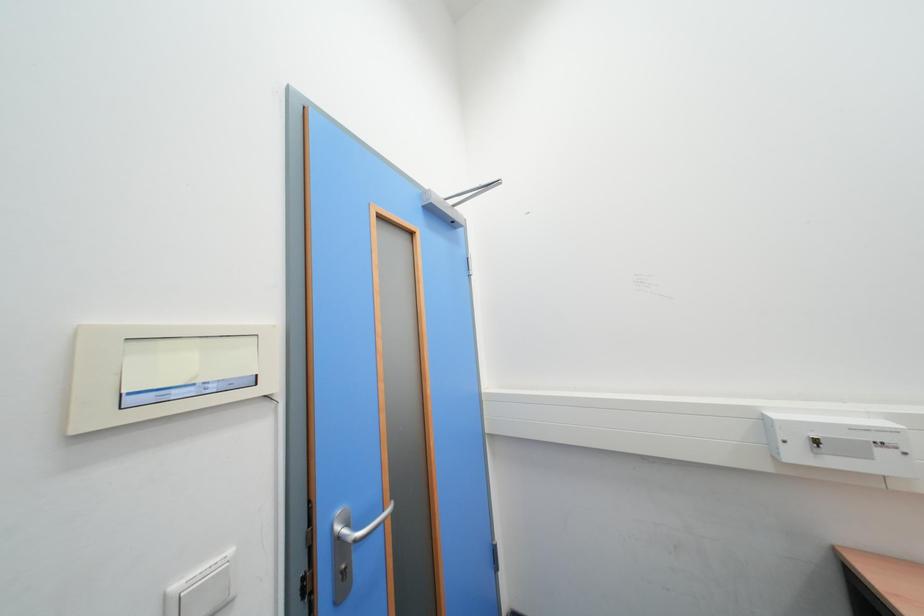
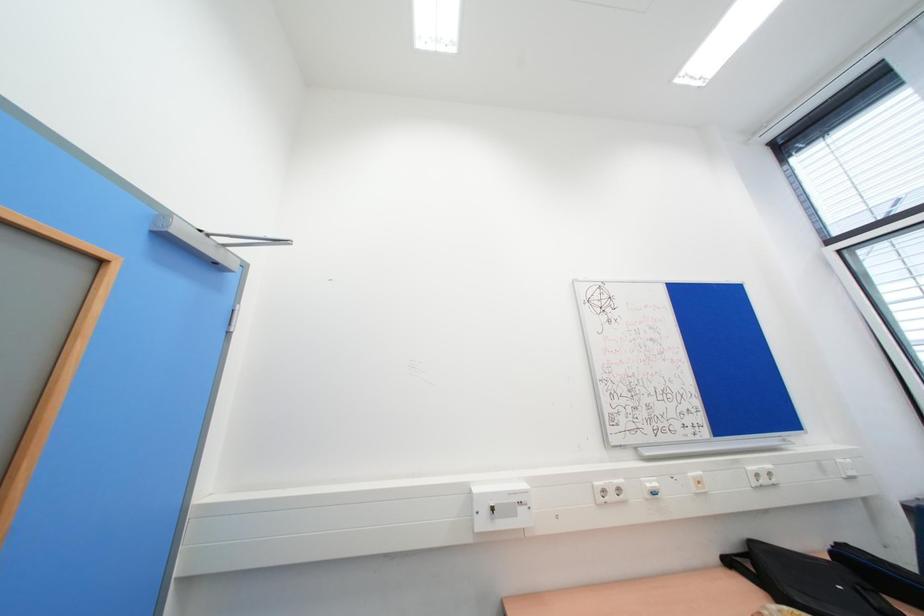
Based on the photo, how did the camera likely rotate?

The camera's rotation is toward right-up.